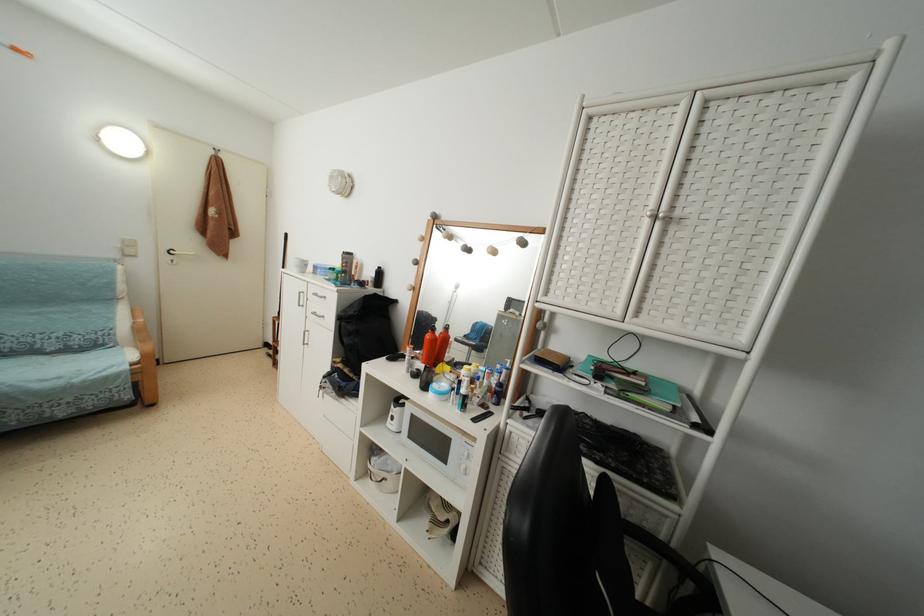
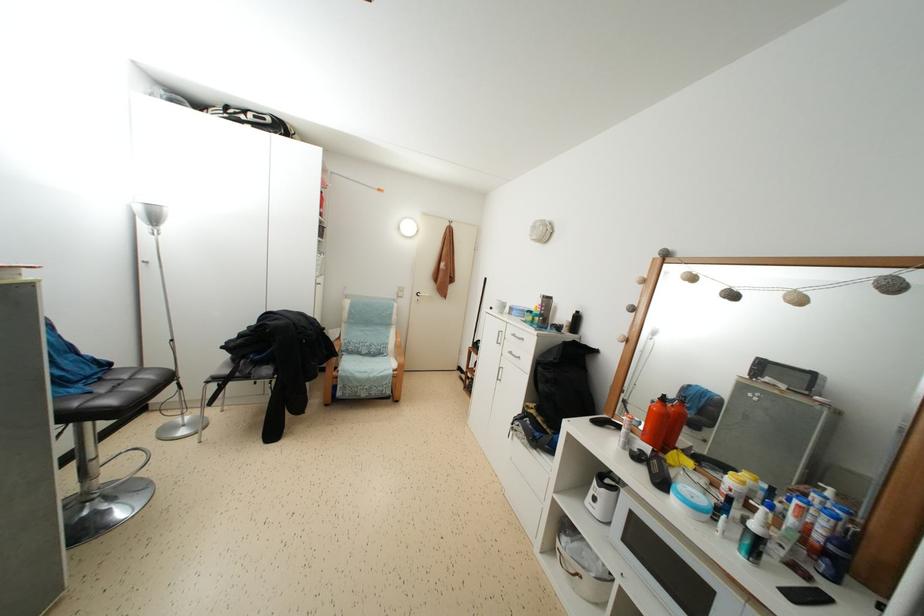
Where in the second image is the point corresponding to pixel 468 403 from the first image?

(763, 546)